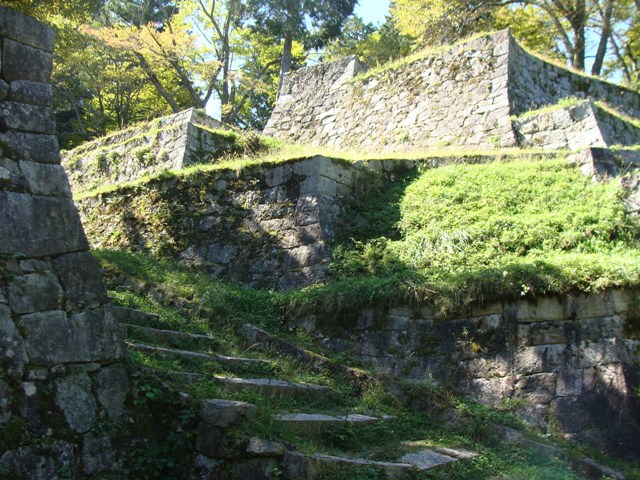
Where is `middle wall`? middle wall is located at coordinates (198, 211).